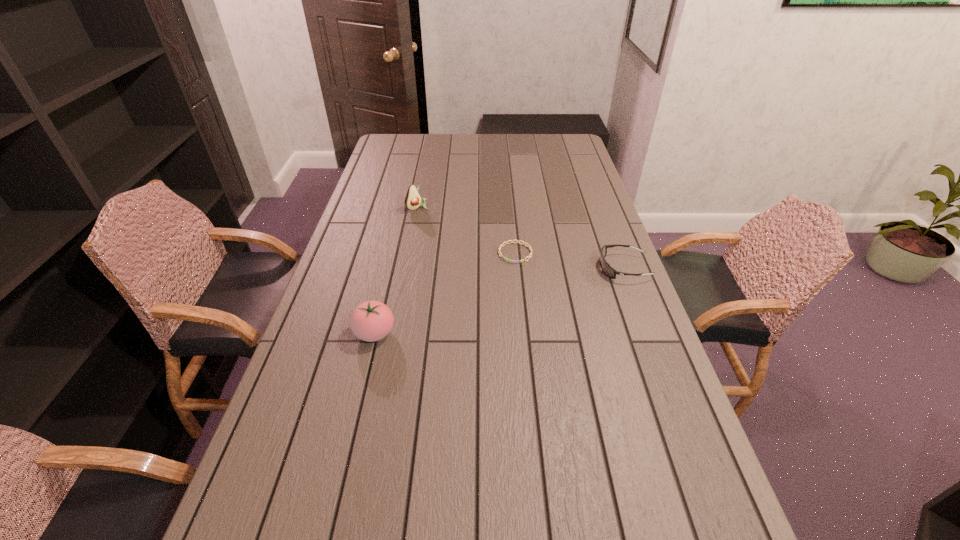
This screenshot has width=960, height=540. What are the coordinates of `free spot on the desktop that is between the tomato and the goggles and is positioned on the surface of the bracelet showing star-shaped elements` in the screenshot? It's located at (490, 303).

Locate an element on the screen. free space on the desktop that is between the nearest object and the second shortest object and is positioned on the seed side of the farthest object is located at coordinates click(x=532, y=292).